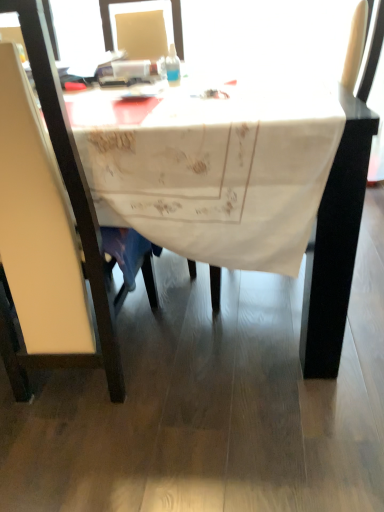
Locate an element on the screen. vacant space that is to the left of transparent plastic bottle at center is located at coordinates (131, 82).